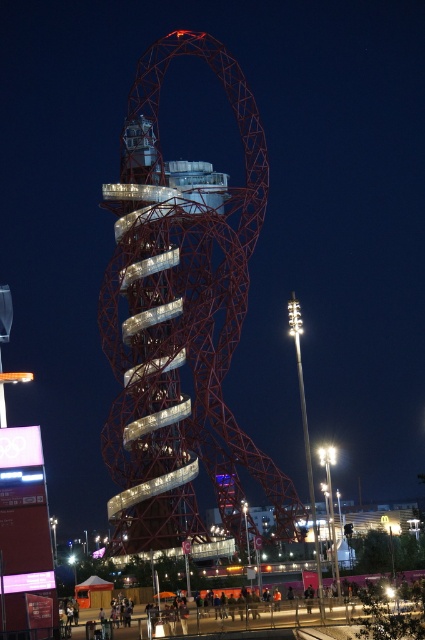
Question: Does metallic red tower at center appear on the left side of metallic amusement park at lower center?

Choices:
 (A) no
 (B) yes

Answer: (B)

Question: Is metallic red tower at center in front of metallic amusement park at lower center?

Choices:
 (A) no
 (B) yes

Answer: (A)

Question: Which point is farther from the camera taking this photo?

Choices:
 (A) (206, 264)
 (B) (289, 618)

Answer: (A)

Question: Does metallic red tower at center have a greater width compared to metallic amusement park at lower center?

Choices:
 (A) yes
 (B) no

Answer: (B)